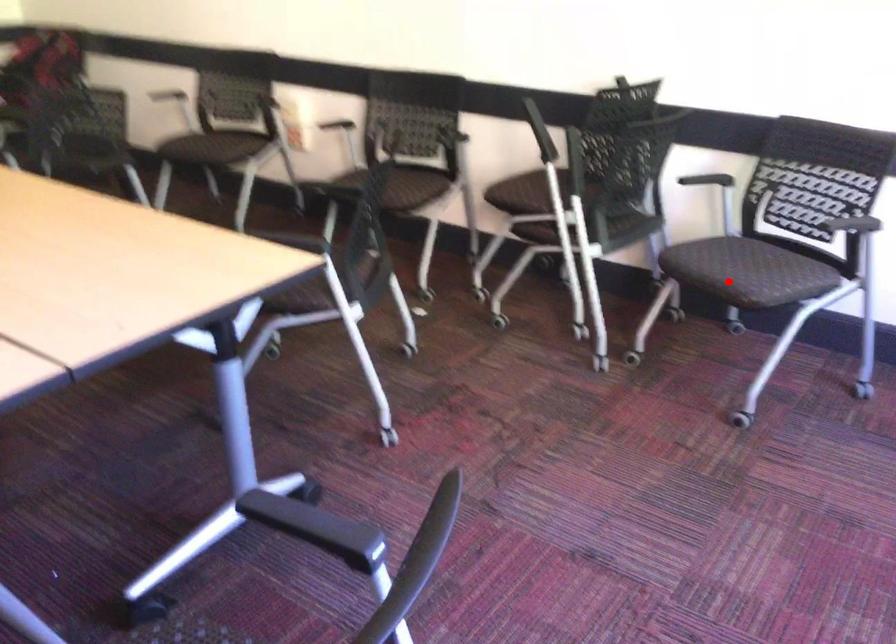
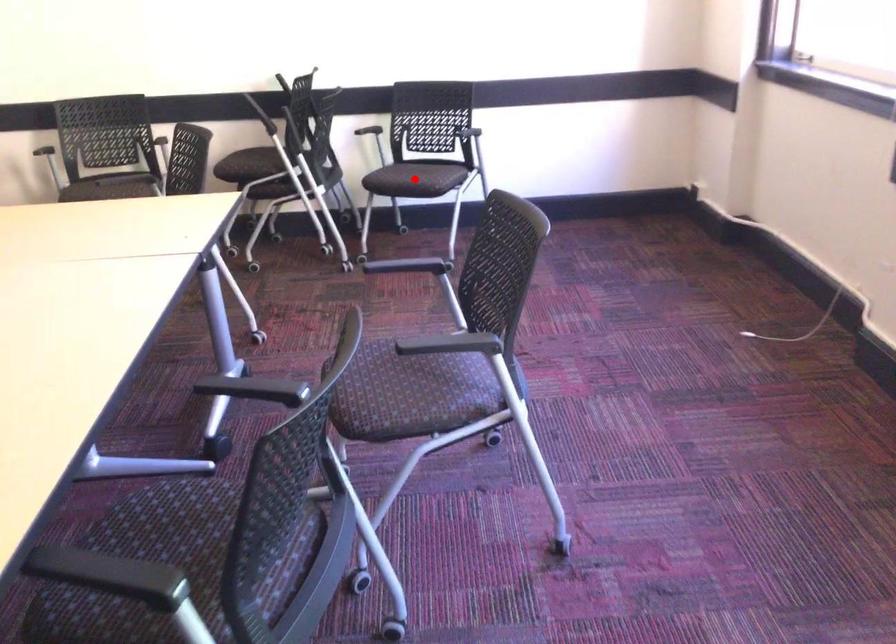
I am providing you with two images of the same scene from different viewpoints. A red point is marked on the first image and another point is marked on the second image. Is the marked point in image1 the same physical position as the marked point in image2?

Yes